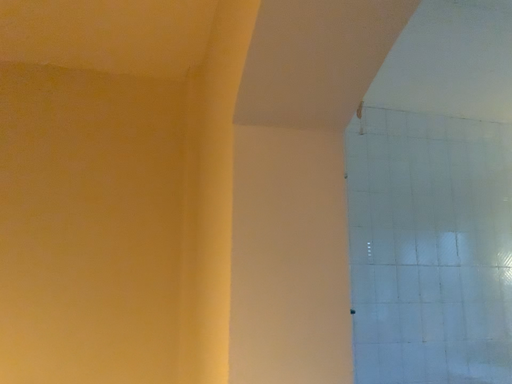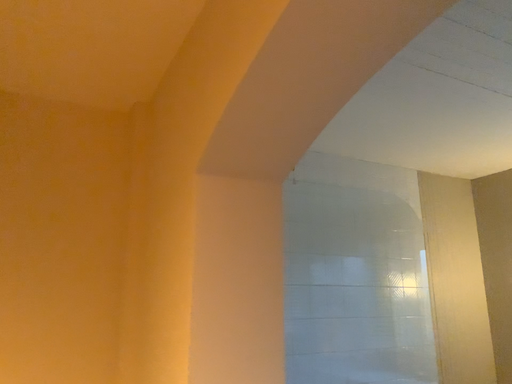
Question: How did the camera likely rotate when shooting the video?

Choices:
 (A) rotated left
 (B) rotated right

Answer: (B)